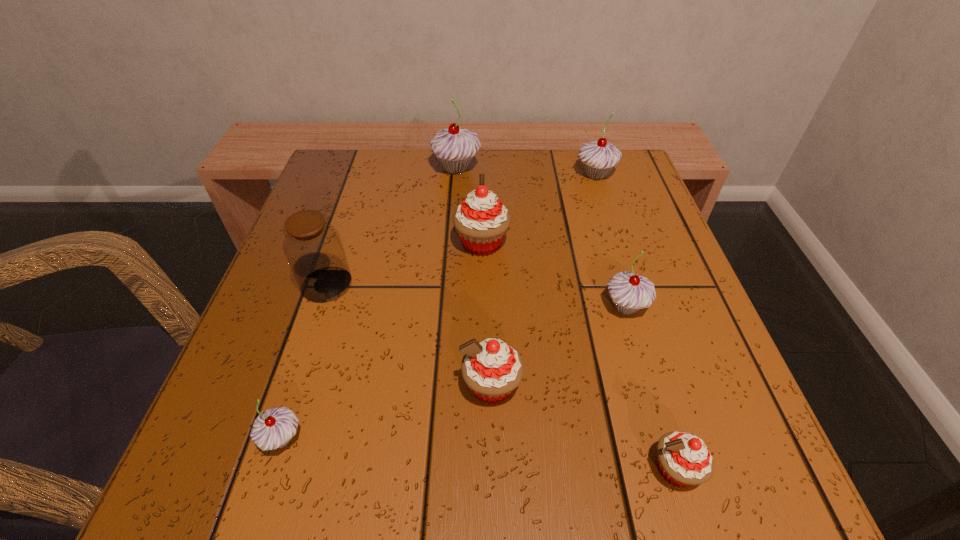
At what (x,y) coordinates should I click in order to perform the action: click on the tallest object. Please return your answer as a coordinate pair (x, y). This screenshot has height=540, width=960. Looking at the image, I should click on (454, 147).

Where is `the tallest cupcake`? Image resolution: width=960 pixels, height=540 pixels. the tallest cupcake is located at coordinates (454, 147).

Where is `the second biggest gray cupcake`? This screenshot has height=540, width=960. the second biggest gray cupcake is located at coordinates (599, 157).

Locate an element on the screen. Image resolution: width=960 pixels, height=540 pixels. the fifth nearest cupcake is located at coordinates (481, 221).

This screenshot has width=960, height=540. I want to click on the farthest pink cupcake, so click(x=481, y=221).

At what (x,y) coordinates should I click in order to perform the action: click on jar. Please return your answer as a coordinate pair (x, y). Looking at the image, I should click on (314, 250).

In order to click on the fourth nearest cupcake in this screenshot , I will do `click(630, 292)`.

At what (x,y) coordinates should I click in order to perform the action: click on the second smallest gray cupcake. Please return your answer as a coordinate pair (x, y). The height and width of the screenshot is (540, 960). Looking at the image, I should click on (630, 292).

The image size is (960, 540). In order to click on the second smallest pink cupcake in this screenshot , I will do `click(492, 369)`.

Find the location of a particular element. Image resolution: width=960 pixels, height=540 pixels. the sixth farthest object is located at coordinates (492, 369).